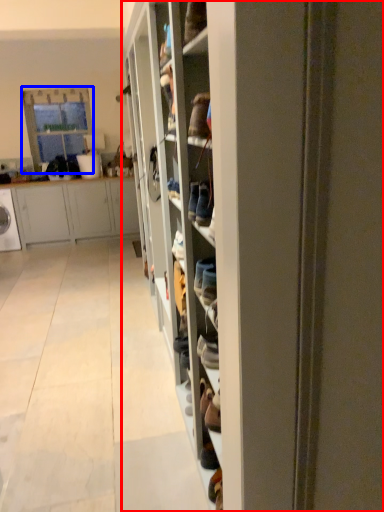
Question: Which object appears closest to the camera in this image, shelf (highlighted by a red box) or glass door (highlighted by a blue box)?

Choices:
 (A) shelf
 (B) glass door

Answer: (A)